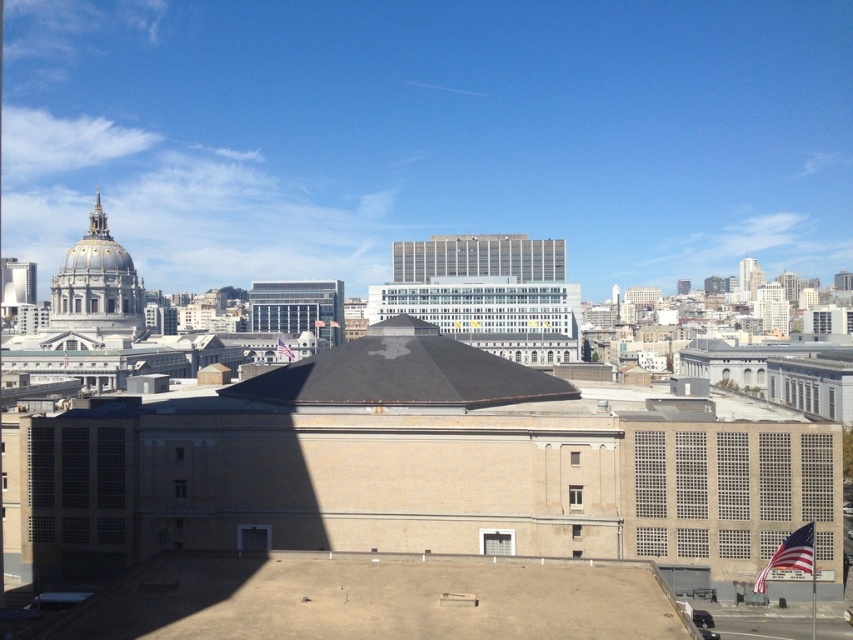
Who is lower down, black matte roof at center or matte gray dome at upper left?

black matte roof at center

Does black matte roof at center appear on the left side of matte gray dome at upper left?

No, black matte roof at center is not to the left of matte gray dome at upper left.

Between point (360, 381) and point (112, 330), which one is positioned behind?

The point (112, 330) is behind.

Find the location of a particular element. The height and width of the screenshot is (640, 853). black matte roof at center is located at coordinates (402, 372).